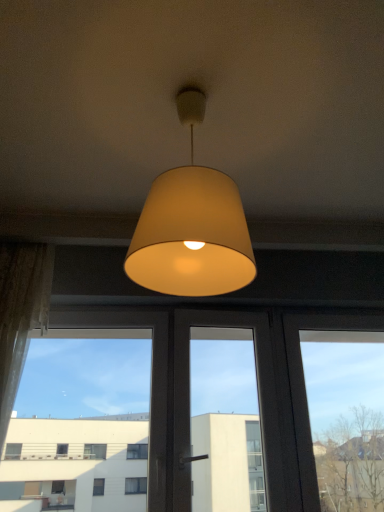
What do you see at coordinates (188, 391) in the screenshot? Image resolution: width=384 pixels, height=512 pixels. I see `transparent glass window at center` at bounding box center [188, 391].

At what (x,y) coordinates should I click in order to perform the action: click on transparent glass window at center. Please return your answer as a coordinate pair (x, y). The image size is (384, 512). Looking at the image, I should click on 188,391.

At what (x,y) coordinates should I click in order to perform the action: click on transparent glass window at center. Please return your answer as a coordinate pair (x, y). Image resolution: width=384 pixels, height=512 pixels. Looking at the image, I should click on (188, 391).

Does matte beige lampshade at center appear on the left side of sheer lace curtain at left?

No, matte beige lampshade at center is not to the left of sheer lace curtain at left.

Considering the points (206, 238) and (45, 250), which point is in front, point (206, 238) or point (45, 250)?

Point (206, 238)

Could sheer lace curtain at left be considered to be inside matte beige lampshade at center?

No, matte beige lampshade at center does not contain sheer lace curtain at left.

Is matte beige lampshade at center aimed at sheer lace curtain at left?

No.

Is transparent glass window at center taller or shorter than sheer lace curtain at left?

Clearly, transparent glass window at center is shorter compared to sheer lace curtain at left.

Which of these two, transparent glass window at center or sheer lace curtain at left, is smaller?

sheer lace curtain at left.

Identify the location of curtain that appears in front of the transparent glass window at center. (20, 314).

How different are the orientations of transparent glass window at center and sheer lace curtain at left in degrees?

They differ by 0.0452 degrees in their facing directions.

You are a GUI agent. You are given a task and a screenshot of the screen. Output one action in this format:
    pyautogui.click(x=<x>, y=<y>)
    Task: Click on the curtain that appears below the matte beige lampshade at center (from the image's perspective)
    
    Given the screenshot: What is the action you would take?
    pyautogui.click(x=20, y=314)

Is matte beige lampshade at center at the back of sheer lace curtain at left?

sheer lace curtain at left is not turned away from matte beige lampshade at center.

From the image's perspective, which one is positioned lower, sheer lace curtain at left or matte beige lampshade at center?

sheer lace curtain at left is shown below in the image.

Which of these two, transparent glass window at center or matte beige lampshade at center, is thinner?

transparent glass window at center.

Is the depth of transparent glass window at center greater than that of matte beige lampshade at center?

That is True.

Considering the relative positions of transparent glass window at center and matte beige lampshade at center in the image provided, is transparent glass window at center to the right of matte beige lampshade at center from the viewer's perspective?

Incorrect, transparent glass window at center is not on the right side of matte beige lampshade at center.

From the image's perspective, which one is positioned higher, transparent glass window at center or matte beige lampshade at center?

matte beige lampshade at center, from the image's perspective.

Considering the sizes of objects matte beige lampshade at center and transparent glass window at center in the image provided, who is bigger, matte beige lampshade at center or transparent glass window at center?

transparent glass window at center.

Which point is more forward, [247,263] or [301,466]?

The point [247,263] is closer to the camera.

Who is taller, matte beige lampshade at center or transparent glass window at center?

Standing taller between the two is transparent glass window at center.

Can we say matte beige lampshade at center lies outside transparent glass window at center?

That's correct, matte beige lampshade at center is outside of transparent glass window at center.

Find the location of a particular element. This screenshot has height=512, width=384. curtain that is on the left side of transparent glass window at center is located at coordinates (20, 314).

From the image's perspective, does sheer lace curtain at left appear higher than transparent glass window at center?

Indeed, from the image's perspective, sheer lace curtain at left is shown above transparent glass window at center.

Between sheer lace curtain at left and transparent glass window at center, which one has less height?

With less height is transparent glass window at center.

I want to click on lamp above the sheer lace curtain at left (from the image's perspective), so click(191, 226).

I want to click on window that appears on the right of sheer lace curtain at left, so click(188, 391).

Looking at the image, which one is located closer to matte beige lampshade at center, sheer lace curtain at left or transparent glass window at center?

sheer lace curtain at left.

Based on their spatial positions, is transparent glass window at center or sheer lace curtain at left further from matte beige lampshade at center?

transparent glass window at center.

Looking at the image, which one is located further to sheer lace curtain at left, matte beige lampshade at center or transparent glass window at center?

matte beige lampshade at center.

From the image, which object appears to be nearer to sheer lace curtain at left, transparent glass window at center or matte beige lampshade at center?

transparent glass window at center lies closer to sheer lace curtain at left than the other object.

Looking at the image, which one is located closer to transparent glass window at center, sheer lace curtain at left or matte beige lampshade at center?

sheer lace curtain at left lies closer to transparent glass window at center than the other object.

When comparing their distances from transparent glass window at center, does matte beige lampshade at center or sheer lace curtain at left seem closer?

Among the two, sheer lace curtain at left is located nearer to transparent glass window at center.

This screenshot has height=512, width=384. What are the coordinates of `curtain between matte beige lampshade at center and transparent glass window at center in the vertical direction` in the screenshot? It's located at (20, 314).